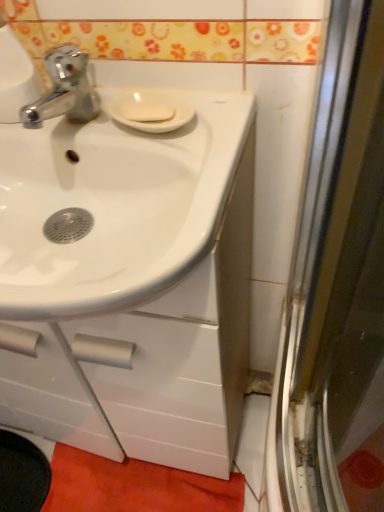
Question: Is white glossy sink at center thinner than white matte soap at center?

Choices:
 (A) yes
 (B) no

Answer: (B)

Question: Is white glossy sink at center further to the viewer compared to white matte soap at center?

Choices:
 (A) no
 (B) yes

Answer: (A)

Question: From a real-world perspective, is white glossy sink at center under white matte soap at center?

Choices:
 (A) no
 (B) yes

Answer: (B)

Question: Considering the relative sizes of white glossy sink at center and white matte soap at center in the image provided, is white glossy sink at center wider than white matte soap at center?

Choices:
 (A) no
 (B) yes

Answer: (B)

Question: Can white matte soap at center be found inside white glossy sink at center?

Choices:
 (A) no
 (B) yes

Answer: (B)

Question: From a real-world perspective, is white glossy sink at center positioned above or below white matte soap at center?

Choices:
 (A) above
 (B) below

Answer: (B)

Question: In terms of height, does white glossy sink at center look taller or shorter compared to white matte soap at center?

Choices:
 (A) tall
 (B) short

Answer: (A)

Question: Is white glossy sink at center wider or thinner than white matte soap at center?

Choices:
 (A) thin
 (B) wide

Answer: (B)

Question: From the image's perspective, is white glossy sink at center located above or below white matte soap at center?

Choices:
 (A) below
 (B) above

Answer: (A)

Question: Considering their positions, is white matte soap at center located in front of or behind orange fabric bath mat at lower center?

Choices:
 (A) behind
 (B) front

Answer: (B)

Question: Is white matte soap at center taller or shorter than orange fabric bath mat at lower center?

Choices:
 (A) short
 (B) tall

Answer: (A)

Question: From the image's perspective, is white matte soap at center above or below orange fabric bath mat at lower center?

Choices:
 (A) below
 (B) above

Answer: (B)

Question: Considering the relative positions of white matte soap at center and orange fabric bath mat at lower center in the image provided, is white matte soap at center to the left or to the right of orange fabric bath mat at lower center?

Choices:
 (A) left
 (B) right

Answer: (B)

Question: From a real-world perspective, is orange fabric bath mat at lower center physically located above or below white matte soap at center?

Choices:
 (A) below
 (B) above

Answer: (A)

Question: Is orange fabric bath mat at lower center wider or thinner than white matte soap at center?

Choices:
 (A) thin
 (B) wide

Answer: (B)